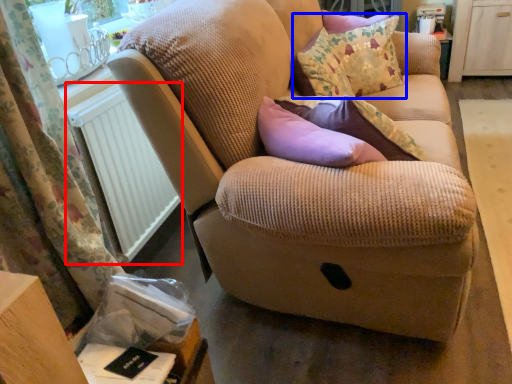
Question: Which object is further to the camera taking this photo, radiator (highlighted by a red box) or throw pillow (highlighted by a blue box)?

Choices:
 (A) radiator
 (B) throw pillow

Answer: (B)